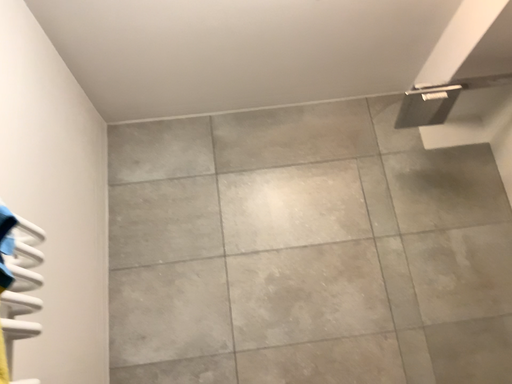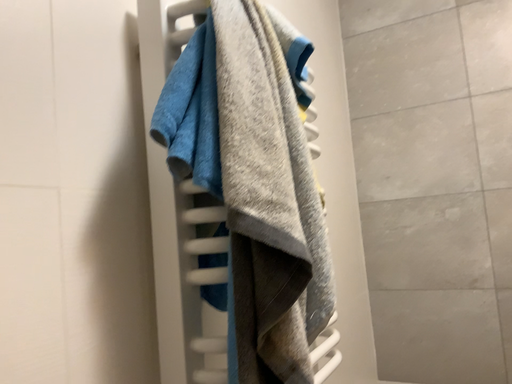
Question: Which way did the camera rotate in the video?

Choices:
 (A) rotated left
 (B) rotated right

Answer: (A)